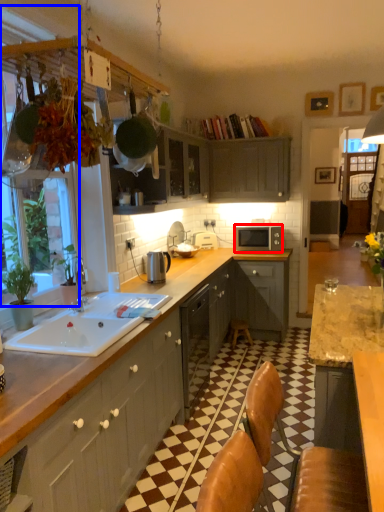
Question: Among these objects, which one is nearest to the camera, microwave oven (highlighted by a red box) or window screen (highlighted by a blue box)?

Choices:
 (A) microwave oven
 (B) window screen

Answer: (B)